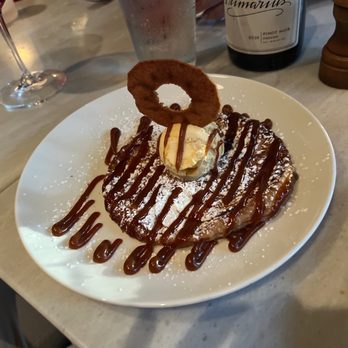
At what (x,y) coordinates should I click in order to perform the action: click on water glass. Please return your answer as a coordinate pair (x, y). Looking at the image, I should click on (166, 37).